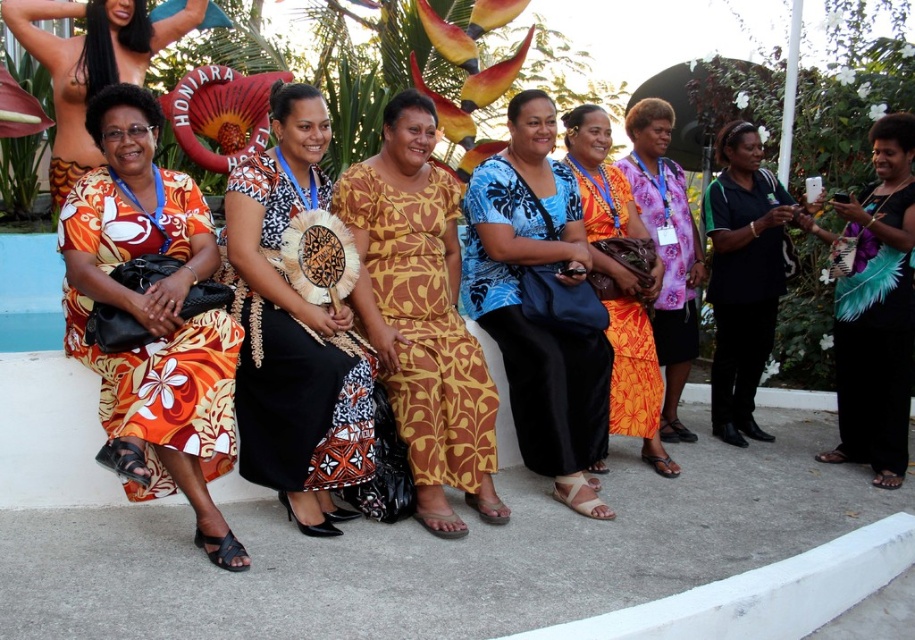
Who is lower down, matte black dress at center or brown printed dress at center?

brown printed dress at center is lower down.

In the scene shown: Does matte black dress at center have a greater height compared to brown printed dress at center?

Incorrect, matte black dress at center's height is not larger of brown printed dress at center's.

This screenshot has width=915, height=640. What do you see at coordinates (294, 330) in the screenshot? I see `matte black dress at center` at bounding box center [294, 330].

At what (x,y) coordinates should I click in order to perform the action: click on matte black dress at center. Please return your answer as a coordinate pair (x, y). Looking at the image, I should click on (294, 330).

The height and width of the screenshot is (640, 915). I want to click on matte black dress at center, so click(294, 330).

Does matte black dress at center have a smaller size compared to floral print dress at center?

Yes, matte black dress at center is smaller than floral print dress at center.

The height and width of the screenshot is (640, 915). What do you see at coordinates (294, 330) in the screenshot?
I see `matte black dress at center` at bounding box center [294, 330].

Identify the location of matte black dress at center. The height and width of the screenshot is (640, 915). (294, 330).

Is orange printed fabric dress at left thinner than blue printed dress at center?

No.

Is orange printed fabric dress at left closer to camera compared to blue printed dress at center?

Yes, it is.

Who is more distant from viewer, (x=171, y=179) or (x=573, y=472)?

Positioned behind is point (x=573, y=472).

Where is `orange printed fabric dress at left`? The width and height of the screenshot is (915, 640). orange printed fabric dress at left is located at coordinates (152, 317).